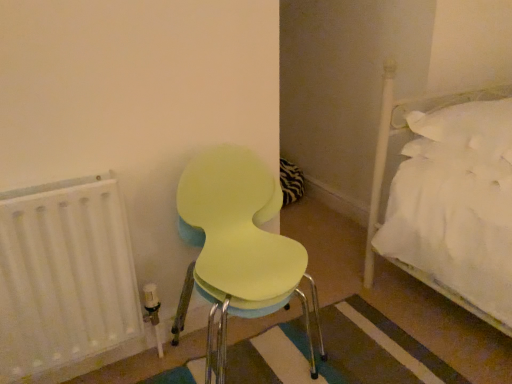
Find the location of a particular element. This screenshot has height=384, width=512. vacant region under light yellow plastic chair at center-left (from a real-world perspective) is located at coordinates (250, 351).